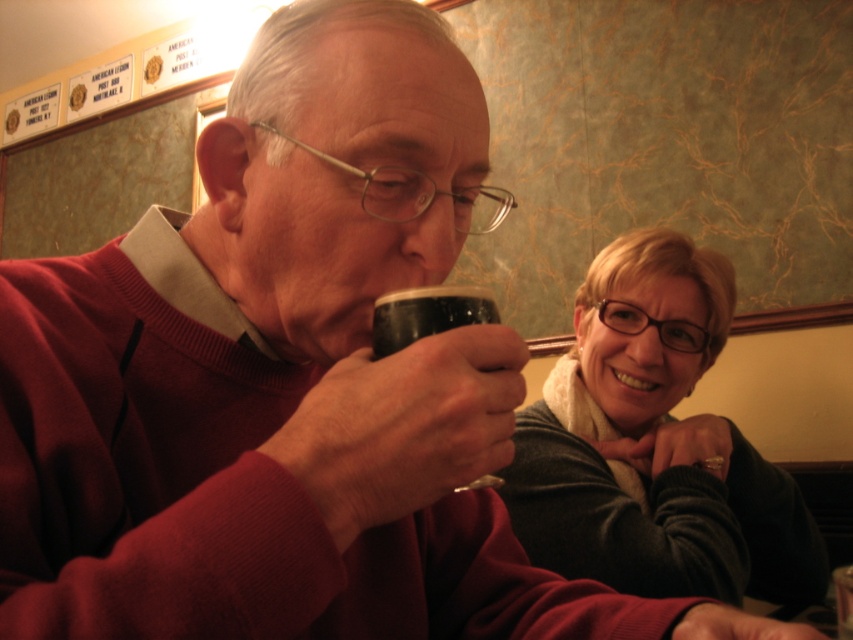
Question: Can you confirm if matte black sweater at upper right is positioned to the left of black matte cup at center?

Choices:
 (A) no
 (B) yes

Answer: (A)

Question: Which object is closer to the camera taking this photo?

Choices:
 (A) matte black sweater at upper right
 (B) black matte cup at center

Answer: (B)

Question: Is matte black sweater at upper right smaller than black matte cup at center?

Choices:
 (A) no
 (B) yes

Answer: (A)

Question: Does matte black sweater at upper right have a lesser width compared to black matte cup at center?

Choices:
 (A) yes
 (B) no

Answer: (B)

Question: Which point is closer to the camera taking this photo?

Choices:
 (A) (762, 540)
 (B) (465, 305)

Answer: (B)